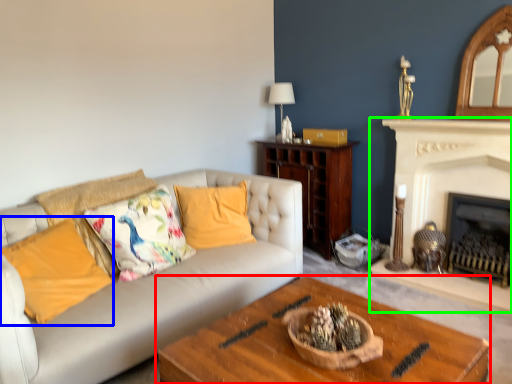
Question: Which is nearer to the coffee table (highlighted by a red box)? pillow (highlighted by a blue box) or fireplace (highlighted by a green box).

Choices:
 (A) pillow
 (B) fireplace

Answer: (A)